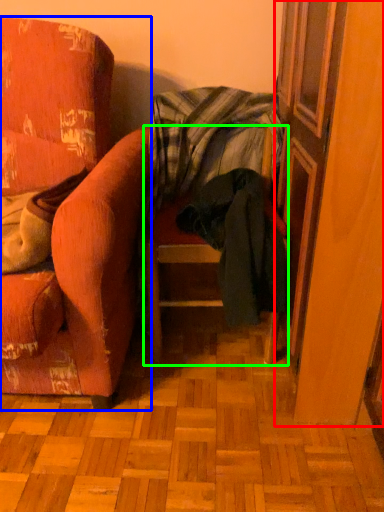
Question: Which object is positioned farthest from screen door (highlighted by a red box)? Select from chair (highlighted by a blue box) and chair (highlighted by a green box).

Choices:
 (A) chair
 (B) chair

Answer: (A)